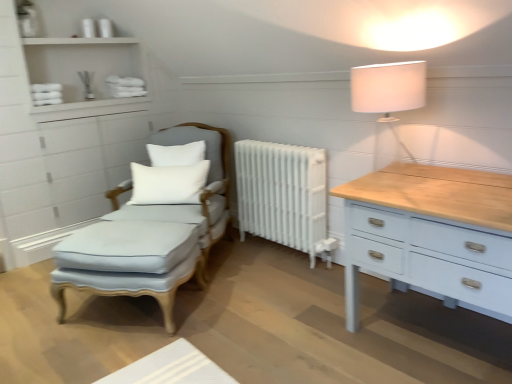
Identify the location of spots to the right of light blue fabric footrest at center. (242, 306).